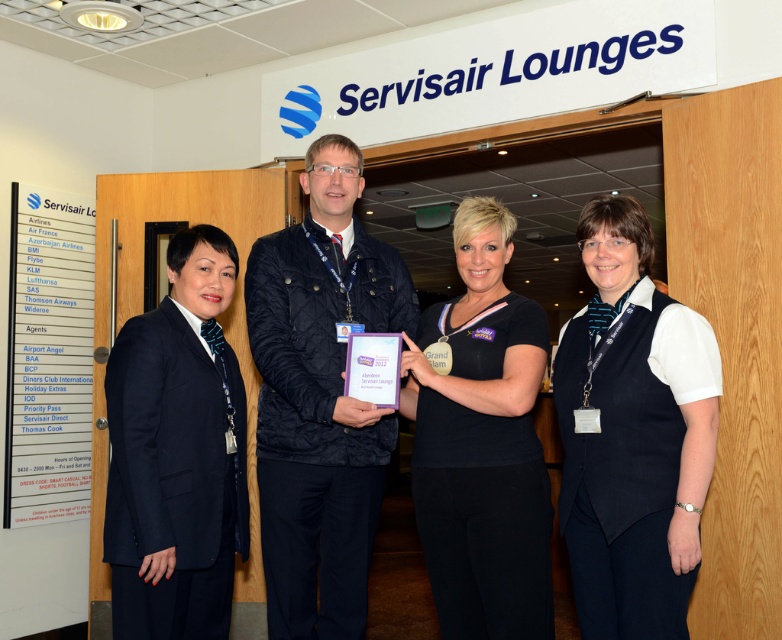
Who is higher up, navy blue vest at center or black fabric shirt at center?

Positioned higher is navy blue vest at center.

Who is positioned more to the left, navy blue vest at center or black fabric shirt at center?

black fabric shirt at center

Where is `navy blue vest at center`? navy blue vest at center is located at coordinates (633, 435).

Find the location of `navy blue vest at center`. navy blue vest at center is located at coordinates (633, 435).

Is dark blue quilted jacket at center shorter than navy blue suit at left?

No.

Can you confirm if dark blue quilted jacket at center is wider than navy blue suit at left?

Indeed, dark blue quilted jacket at center has a greater width compared to navy blue suit at left.

This screenshot has width=782, height=640. What do you see at coordinates (320, 397) in the screenshot?
I see `dark blue quilted jacket at center` at bounding box center [320, 397].

Find the location of `dark blue quilted jacket at center`. dark blue quilted jacket at center is located at coordinates (320, 397).

Is navy blue vest at center closer to the viewer compared to navy blue suit at left?

Yes.

Between navy blue vest at center and navy blue suit at left, which one is positioned lower?

navy blue suit at left is below.

Does point (633, 240) lie in front of point (210, 461)?

That is True.

Locate an element on the screen. The height and width of the screenshot is (640, 782). navy blue vest at center is located at coordinates (633, 435).